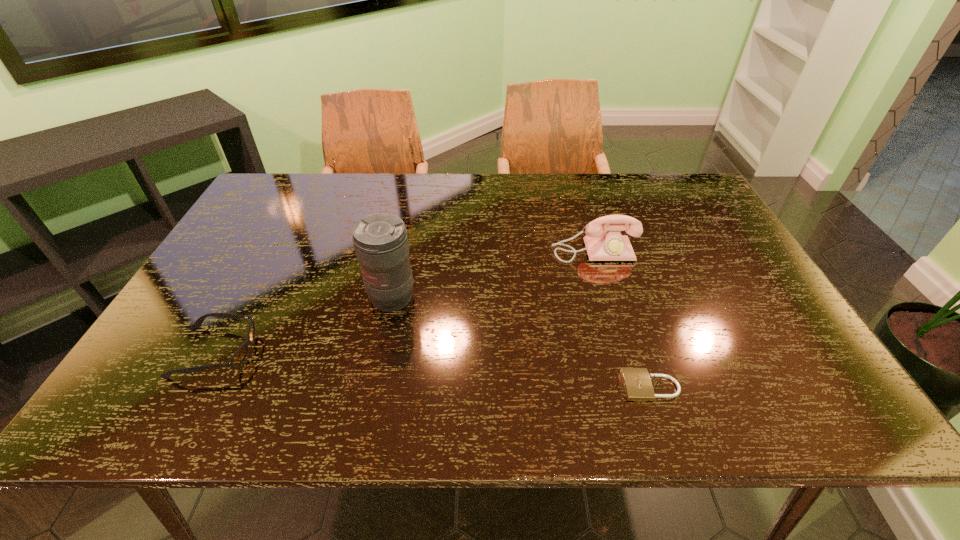
At what (x,y) coordinates should I click in order to perform the action: click on vacant area located on the left of the padlock. Please return your answer as a coordinate pair (x, y). The image size is (960, 540). Looking at the image, I should click on (469, 387).

You are a GUI agent. You are given a task and a screenshot of the screen. Output one action in this format:
    pyautogui.click(x=<x>, y=<y>)
    Task: Click on the object that is at the near edge
    The image size is (960, 540).
    Given the screenshot: What is the action you would take?
    pyautogui.click(x=637, y=384)

The width and height of the screenshot is (960, 540). Identify the location of object present at the left edge. (237, 359).

This screenshot has height=540, width=960. I want to click on vacant area at the far edge of the desktop, so click(x=425, y=176).

Where is `vacant space at the near edge of the desktop`? vacant space at the near edge of the desktop is located at coordinates (217, 424).

Find the location of `vacant space at the left edge`. vacant space at the left edge is located at coordinates (179, 321).

Where is `vacant region at the right edge of the desktop`? vacant region at the right edge of the desktop is located at coordinates (708, 232).

This screenshot has height=540, width=960. Identify the location of free space at the far left corner of the desktop. (283, 195).

This screenshot has width=960, height=540. Identify the location of free space at the near left corner of the desktop. (162, 410).

Image resolution: width=960 pixels, height=540 pixels. Find the location of `vacant space at the far right corner`. vacant space at the far right corner is located at coordinates (669, 187).